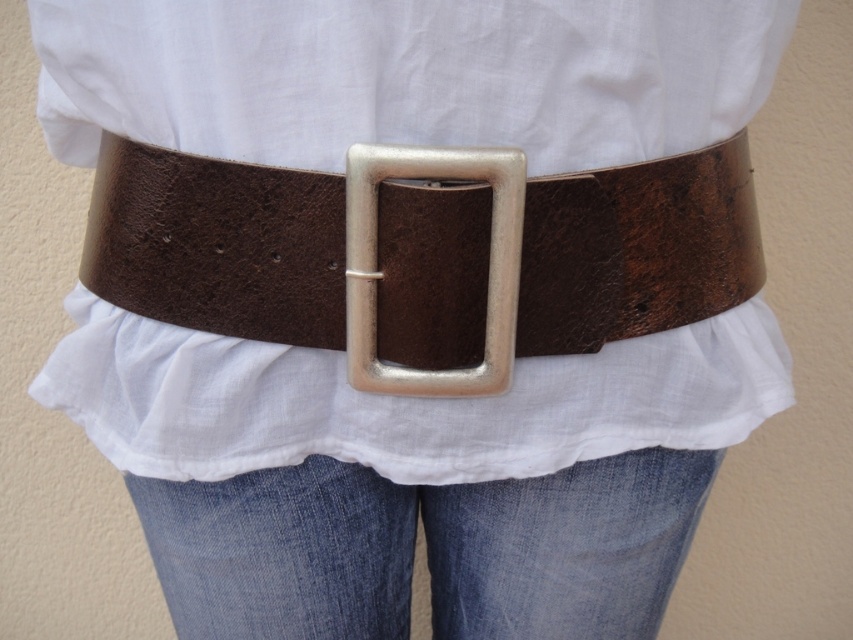
Does denim at center have a larger size compared to metallic silver buckle at center?

Indeed, denim at center has a larger size compared to metallic silver buckle at center.

Does denim at center have a smaller size compared to metallic silver buckle at center?

No.

Between point (659, 582) and point (364, 241), which one is positioned in front?

Point (364, 241) is in front.

I want to click on denim at center, so coord(426,548).

Can you confirm if brown leather belt at center is taller than denim at center?

In fact, brown leather belt at center may be shorter than denim at center.

The image size is (853, 640). What are the coordinates of `brown leather belt at center` in the screenshot? It's located at (218, 244).

Locate an element on the screen. brown leather belt at center is located at coordinates (218, 244).

Is point (663, 333) positioned after point (349, 356)?

Yes.

Does white cotton shirt at center have a greater width compared to metallic silver buckle at center?

Indeed, white cotton shirt at center has a greater width compared to metallic silver buckle at center.

Who is more forward, [53,8] or [473,157]?

Positioned in front is point [473,157].

The height and width of the screenshot is (640, 853). Find the location of `white cotton shirt at center`. white cotton shirt at center is located at coordinates (404, 74).